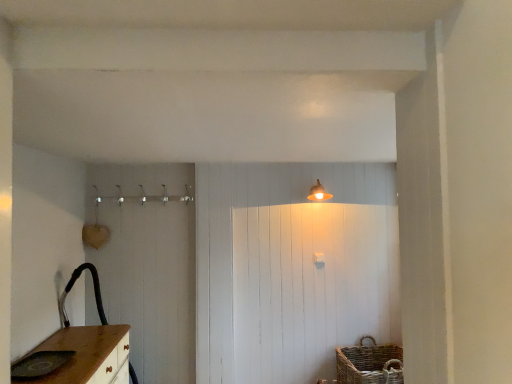
Question: Does matte gray sink at lower left come in front of matte gold light fixture at upper center?

Choices:
 (A) yes
 (B) no

Answer: (A)

Question: Is matte gray sink at lower left at the left side of matte gold light fixture at upper center?

Choices:
 (A) no
 (B) yes

Answer: (B)

Question: Considering the relative sizes of matte gray sink at lower left and matte gold light fixture at upper center in the image provided, is matte gray sink at lower left wider than matte gold light fixture at upper center?

Choices:
 (A) yes
 (B) no

Answer: (A)

Question: Considering the relative sizes of matte gray sink at lower left and matte gold light fixture at upper center in the image provided, is matte gray sink at lower left shorter than matte gold light fixture at upper center?

Choices:
 (A) yes
 (B) no

Answer: (A)

Question: Is matte gray sink at lower left beside matte gold light fixture at upper center?

Choices:
 (A) no
 (B) yes

Answer: (A)

Question: Does matte gray sink at lower left have a smaller size compared to matte gold light fixture at upper center?

Choices:
 (A) no
 (B) yes

Answer: (B)

Question: Is matte gold light fixture at upper center facing towards woven brown basket at lower right?

Choices:
 (A) yes
 (B) no

Answer: (B)

Question: Is matte gold light fixture at upper center wider than woven brown basket at lower right?

Choices:
 (A) yes
 (B) no

Answer: (B)

Question: Is matte gold light fixture at upper center not within woven brown basket at lower right?

Choices:
 (A) yes
 (B) no

Answer: (A)

Question: Is matte gold light fixture at upper center thinner than woven brown basket at lower right?

Choices:
 (A) yes
 (B) no

Answer: (A)

Question: Considering the relative positions of matte gold light fixture at upper center and woven brown basket at lower right in the image provided, is matte gold light fixture at upper center to the left of woven brown basket at lower right from the viewer's perspective?

Choices:
 (A) no
 (B) yes

Answer: (B)

Question: Is matte gold light fixture at upper center shorter than woven brown basket at lower right?

Choices:
 (A) no
 (B) yes

Answer: (B)

Question: Is matte gold light fixture at upper center beside matte gray sink at lower left?

Choices:
 (A) yes
 (B) no

Answer: (B)